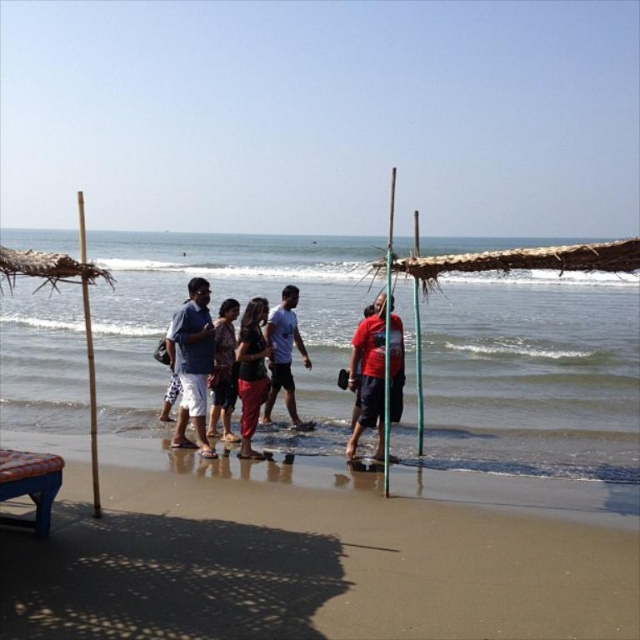
You are standing at the beach and want to take a photo of both the point at coordinates point [170,362] and point [90,468]. Which point should you focus on first to ensure both are in focus?

You should focus on point [90,468] first because it is closer to the camera than point [170,362]. By focusing on the closer point, the farther point will also be within the depth of field, ensuring both are in focus.

Looking at this image, you are standing at the point with coordinates (317, 552) on the image. What is the name of the object you are currently standing on?

The sandy beach at lower center is located at point (317, 552), so you are standing on the sandy beach at lower center.